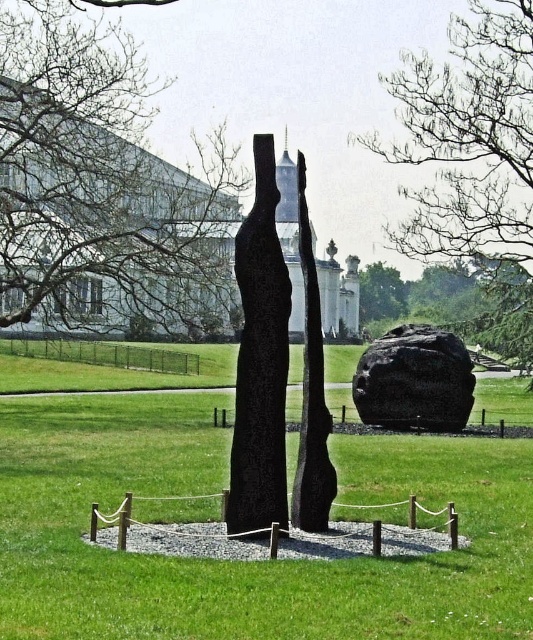
Question: Based on their relative distances, which object is nearer to the polished dark stone sculpture at center?

Choices:
 (A) green leafy tree at center
 (B) black polished stone at center
 (C) smooth bark tree at center

Answer: (B)

Question: Does smooth bark tree at center appear on the left side of green leafy tree at center?

Choices:
 (A) yes
 (B) no

Answer: (A)

Question: Can you confirm if smooth bark tree at center is positioned to the left of polished dark stone sculpture at center?

Choices:
 (A) no
 (B) yes

Answer: (B)

Question: Does green grass at center have a lesser width compared to black polished stone at center?

Choices:
 (A) no
 (B) yes

Answer: (A)

Question: Which point is closer to the camera?

Choices:
 (A) (230, 445)
 (B) (318, 362)
 (C) (379, 284)

Answer: (B)

Question: Which point appears closest to the camera in this image?

Choices:
 (A) (4, 595)
 (B) (463, 198)
 (C) (92, 92)

Answer: (A)